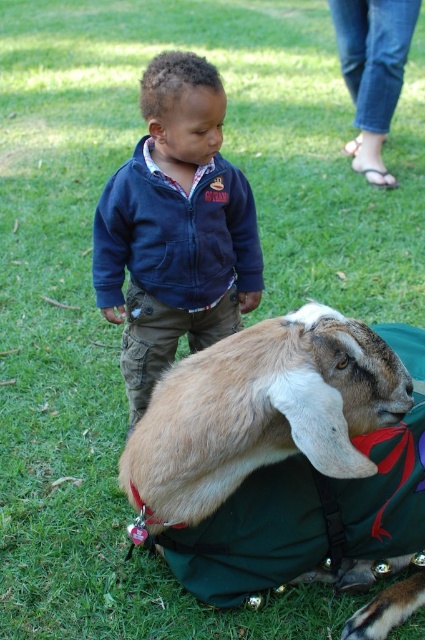
You are a photographer trying to capture a clear shot of the light brown fur at center and the navy blue fleece jacket at center. Since you want both subjects in focus, which one should you adjust your camera focus on first?

The light brown fur at center is positioned under navy blue fleece jacket at center, so you should focus on the navy blue fleece jacket at center first because it is closer to the camera.

You are a parent trying to ensure your child stays warm while interacting with the goat. The child is wearing a navy blue fleece jacket at center, and the goat has light brown fur at center. Given that the distance between them is 30.54 inches, can the child safely interact with the goat without the jacket getting too close to the goat?

The distance between the light brown fur at center and the navy blue fleece jacket at center is 30.54 inches, which is a safe distance for interaction. The child can safely interact with the goat without the jacket getting too close.